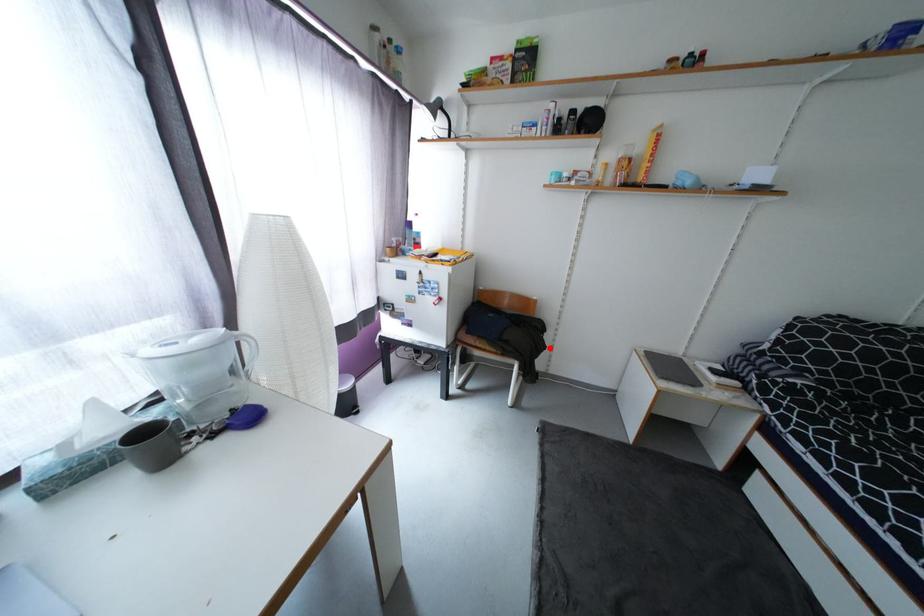
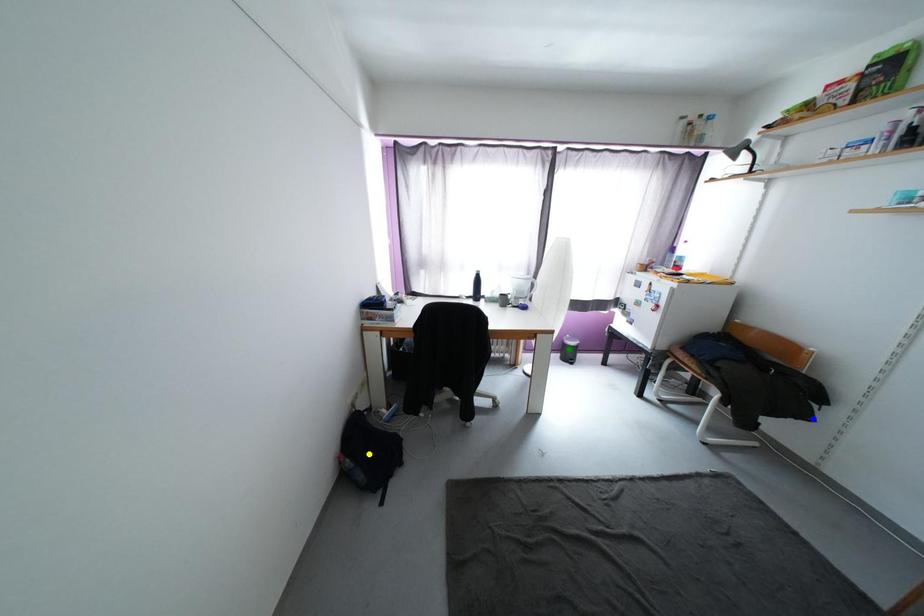
Question: I am providing you with two images of the same scene from different viewpoints. A red point is marked on the first image. You are given multiple points on the second image. Which spot in image 2 lines up with the point in image 1?

Choices:
 (A) blue point
 (B) yellow point
 (C) green point

Answer: (A)